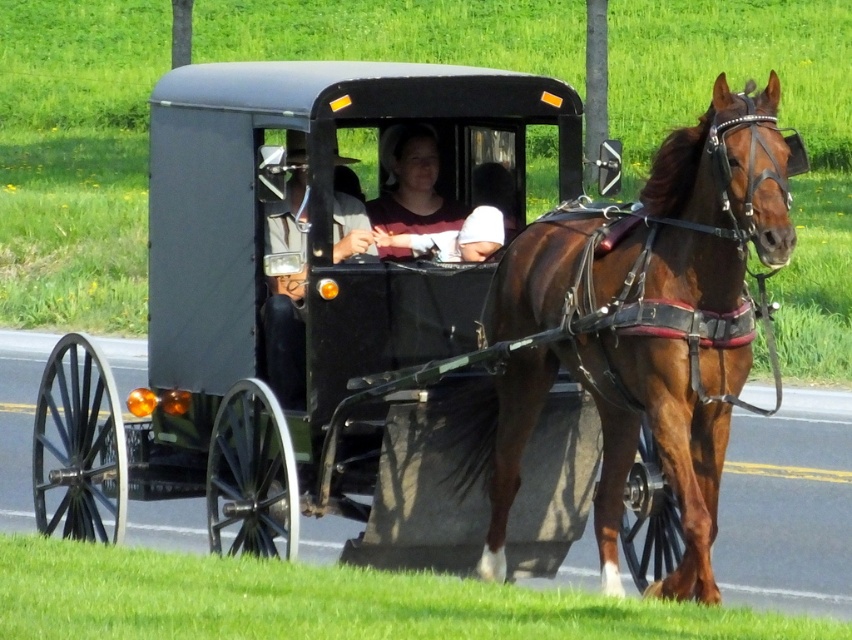
Question: Is matte black wagon at center further to camera compared to brown glossy horse at center?

Choices:
 (A) no
 (B) yes

Answer: (B)

Question: Can you confirm if matte black wagon at center is wider than matte purple shirt at center?

Choices:
 (A) no
 (B) yes

Answer: (B)

Question: Which of the following is the closest to the observer?

Choices:
 (A) (278, 301)
 (B) (676, 346)

Answer: (B)

Question: Which point is closer to the camera?

Choices:
 (A) matte black buggy at center
 (B) matte purple shirt at center

Answer: (A)

Question: Estimate the real-world distances between objects in this image. Which object is farther from the brown glossy horse at center?

Choices:
 (A) matte black wagon at center
 (B) matte black buggy at center

Answer: (B)

Question: In this image, where is brown glossy horse at center located relative to matte black buggy at center?

Choices:
 (A) below
 (B) above

Answer: (A)